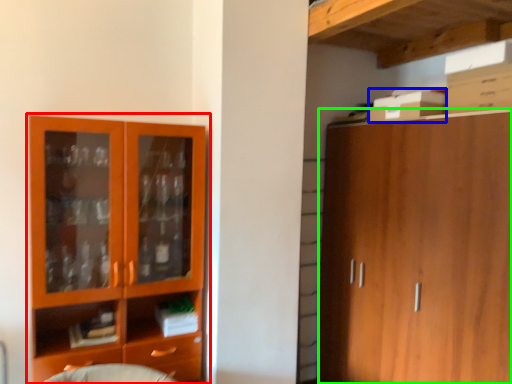
Question: Which object is the farthest from cupboard (highlighted by a red box)? Choose among these: cardboard box (highlighted by a blue box) or cabinetry (highlighted by a green box).

Choices:
 (A) cardboard box
 (B) cabinetry

Answer: (A)